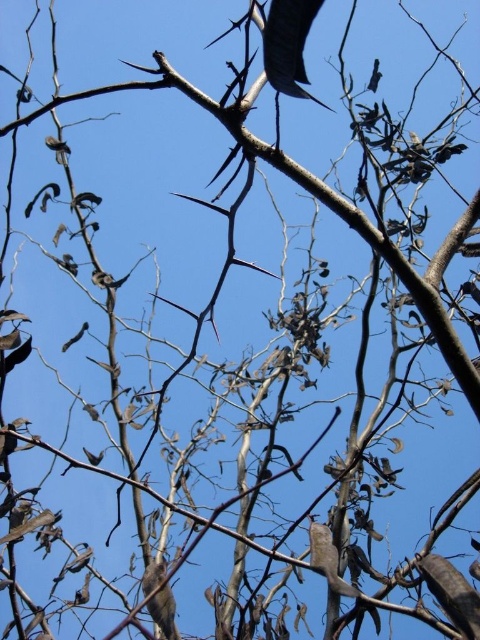
You are an artist sketching the tree branches in the image. You notice a specific point marked at coordinates point (288, 44). What object is located at this point?

The point (288, 44) marks the location of a shiny black leaf at upper center.

Consider the image. You are an ornithologist observing the tree. You notice the shiny black leaf at upper center and the brown feathered bird at lower center. Which object has a smaller width?

The shiny black leaf at upper center is thinner than the brown feathered bird at lower center, so the shiny black leaf at upper center has a smaller width.

You are an ornithologist observing a brown feathered bird at lower center and a shiny black leaf at upper center in a tree. Which object is positioned to the east if the sun is setting in the west?

The shiny black leaf at upper center is to the right of the brown feathered bird at lower center. Since the sun is setting in the west, the right side of the image corresponds to the east direction. Therefore, the shiny black leaf at upper center is positioned to the east of the brown feathered bird at lower center.